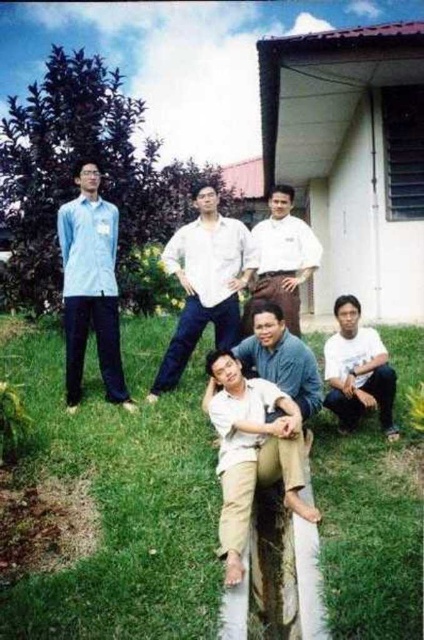
You are standing at the point labeled point (203, 284) and want to move towards the house on the right. Is the white cotton shirt at center in your way?

The white cotton shirt at center is located at point (203, 284), which is your current position. Since you are already at the location of the white cotton shirt at center, it is not blocking your path to the house on the right.

You are standing in the backyard and want to place a 1.5 meter long bench in the exact location of the point at coordinates point (167, 547). Will the bench fit entirely within the visible grassy area without overlapping the house or any other structures?

The point at coordinates point (167, 547) is 3.97 meters away from the viewer. Since the bench is 1.5 meters long, it should fit within the grassy area as long as the placement direction allows sufficient space. However, without knowing the exact dimensions of the grassy area or the proximity to the house, we can only confirm the distance from the viewer. The bench can be placed there, but ensure it doesn not encroach on the house or other structures.

You are a photographer trying to capture a candid shot of the matte blue shirt at left without including the beige cotton pants at lower center in the frame. Based on their positions, is this possible?

The beige cotton pants at lower center is in front of the matte blue shirt at left, so it would be difficult to capture the matte blue shirt at left without including the beige cotton pants at lower center in the frame.